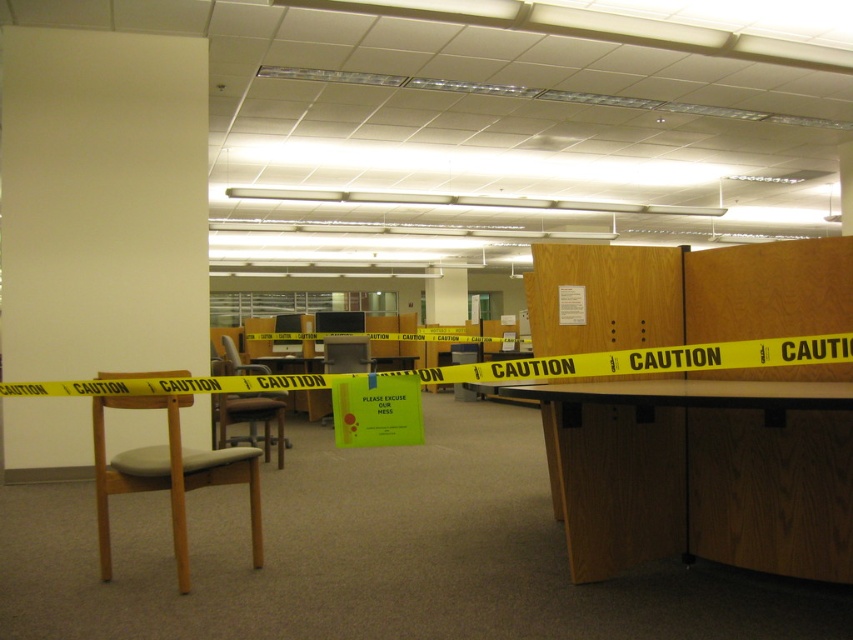
Does point (572, 396) come farther from viewer compared to point (267, 372)?

No, (572, 396) is closer to viewer.

Is wooden table at lower right to the left of wooden chair at left from the viewer's perspective?

No, wooden table at lower right is not to the left of wooden chair at left.

At what (x,y) coordinates should I click in order to perform the action: click on wooden table at lower right. Please return your answer as a coordinate pair (x, y). Image resolution: width=853 pixels, height=640 pixels. Looking at the image, I should click on (701, 474).

Does wooden table at lower right have a greater height compared to light brown wood swivel chair at left?

In fact, wooden table at lower right may be shorter than light brown wood swivel chair at left.

Does wooden table at lower right appear under light brown wood swivel chair at left?

Incorrect, wooden table at lower right is not positioned below light brown wood swivel chair at left.

The height and width of the screenshot is (640, 853). I want to click on wooden table at lower right, so (x=701, y=474).

Is light brown wood swivel chair at left to the right of wooden chair at left from the viewer's perspective?

Yes, light brown wood swivel chair at left is to the right of wooden chair at left.

Who is shorter, light brown wood swivel chair at left or wooden chair at left?

With less height is wooden chair at left.

This screenshot has width=853, height=640. What do you see at coordinates (167, 476) in the screenshot? I see `light brown wood swivel chair at left` at bounding box center [167, 476].

This screenshot has width=853, height=640. What are the coordinates of `light brown wood swivel chair at left` in the screenshot? It's located at (167, 476).